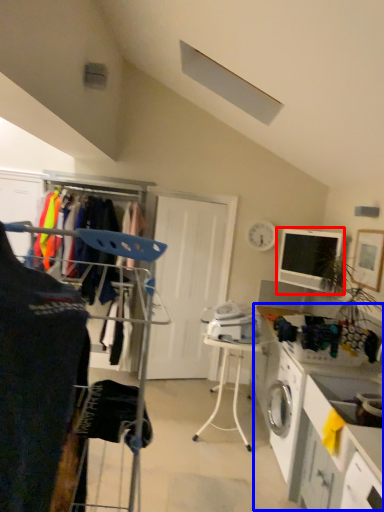
Question: Among these objects, which one is nearest to the camera, computer monitor (highlighted by a red box) or counter (highlighted by a blue box)?

Choices:
 (A) computer monitor
 (B) counter

Answer: (B)